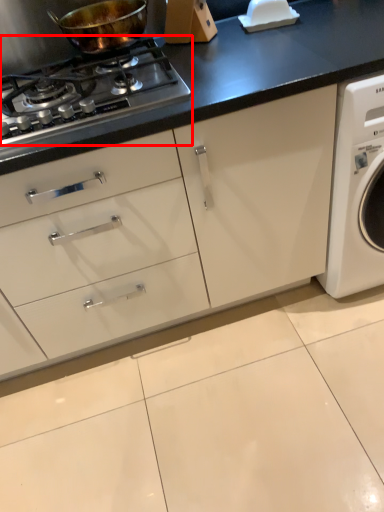
Question: From the image's perspective, what is the correct spatial relationship of gas stove (annotated by the red box) in relation to kitchen appliance?

Choices:
 (A) above
 (B) below

Answer: (B)